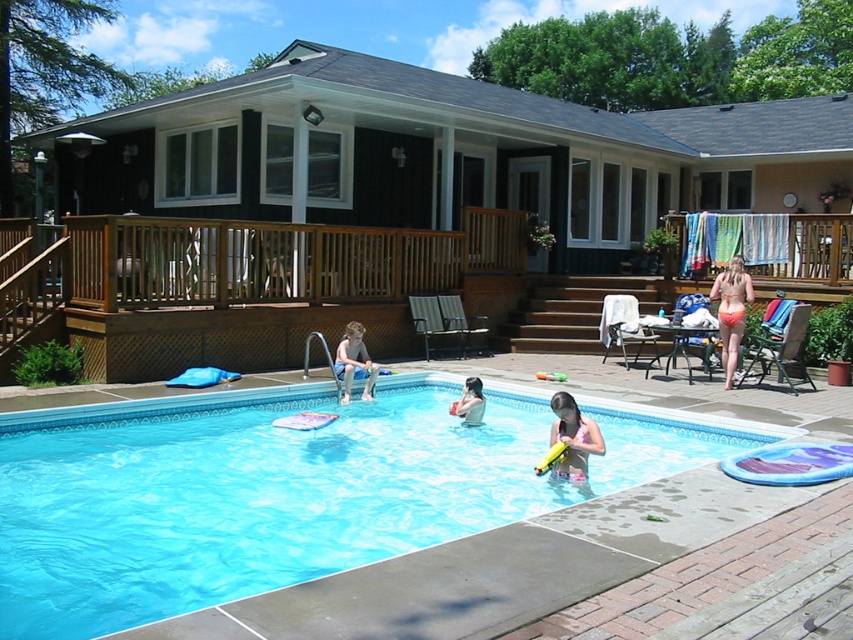
Question: Is wooden deck at center to the left of pink rubber at lower right from the viewer's perspective?

Choices:
 (A) yes
 (B) no

Answer: (A)

Question: Can you confirm if orange bikini at right is wider than smooth pink swimwear at lower center?

Choices:
 (A) no
 (B) yes

Answer: (B)

Question: Which of the following is the closest to the observer?

Choices:
 (A) pink rubber at lower right
 (B) orange bikini at right

Answer: (A)

Question: Among these objects, which one is farthest from the camera?

Choices:
 (A) wooden deck at center
 (B) blue tile swimming pool at center

Answer: (A)

Question: Among these points, which one is farthest from the camera?

Choices:
 (A) (355, 356)
 (B) (563, 464)

Answer: (A)

Question: From the image, what is the correct spatial relationship of wooden deck at center in relation to orange bikini at right?

Choices:
 (A) above
 (B) below

Answer: (A)